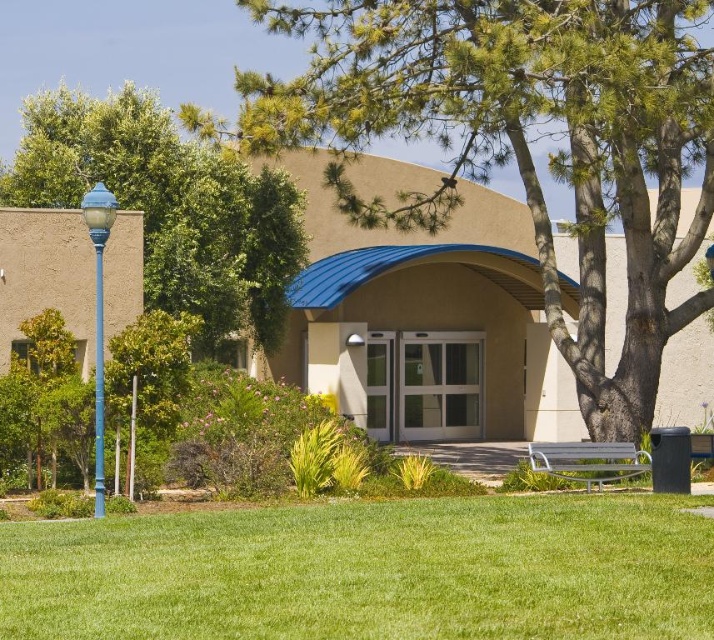
Does point (558, 285) come farther from viewer compared to point (99, 328)?

That is True.

Who is positioned more to the left, green leafy tree at center or blue metallic lamp post at left?

From the viewer's perspective, blue metallic lamp post at left appears more on the left side.

Image resolution: width=714 pixels, height=640 pixels. What do you see at coordinates (521, 141) in the screenshot?
I see `green leafy tree at center` at bounding box center [521, 141].

This screenshot has height=640, width=714. What are the coordinates of `green leafy tree at center` in the screenshot? It's located at (521, 141).

This screenshot has height=640, width=714. I want to click on green grass at lower center, so click(x=368, y=572).

Consider the image. Which is above, green grass at lower center or metallic silver bench at lower right?

green grass at lower center is higher up.

Is point (411, 614) farther from viewer compared to point (590, 461)?

No, (411, 614) is closer to viewer.

The image size is (714, 640). I want to click on green grass at lower center, so click(x=368, y=572).

Can you confirm if green leafy tree at center is smaller than green grass at lower center?

Actually, green leafy tree at center might be larger than green grass at lower center.

Which is above, green leafy tree at center or green grass at lower center?

green leafy tree at center

Based on the photo, who is more distant from viewer, (441, 129) or (281, 630)?

The point (441, 129) is more distant.

Identify the location of green leafy tree at center. (521, 141).